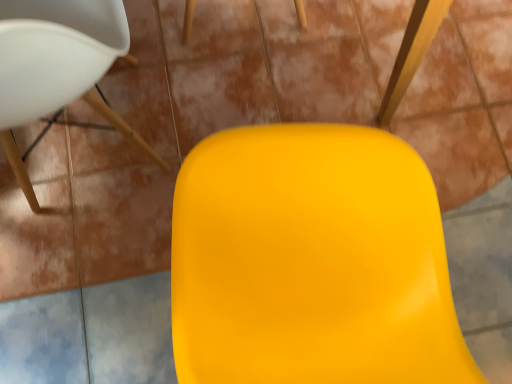
Looking at this image, what is the approximate width of glossy plastic swivel chair at center?

The width of glossy plastic swivel chair at center is 21.85 inches.

The height and width of the screenshot is (384, 512). Describe the element at coordinates (311, 261) in the screenshot. I see `glossy plastic swivel chair at center` at that location.

Image resolution: width=512 pixels, height=384 pixels. In order to click on glossy plastic swivel chair at center in this screenshot , I will do 311,261.

Image resolution: width=512 pixels, height=384 pixels. I want to click on matte white chair at upper left, so click(x=57, y=65).

Image resolution: width=512 pixels, height=384 pixels. What do you see at coordinates (57, 65) in the screenshot?
I see `matte white chair at upper left` at bounding box center [57, 65].

This screenshot has width=512, height=384. In order to click on glossy plastic swivel chair at center in this screenshot , I will do `click(311, 261)`.

Can you confirm if glossy plastic swivel chair at center is positioned to the left of matte white chair at upper left?

Incorrect, glossy plastic swivel chair at center is not on the left side of matte white chair at upper left.

Does glossy plastic swivel chair at center come behind matte white chair at upper left?

No, the depth of glossy plastic swivel chair at center is less than that of matte white chair at upper left.

Is point (252, 130) farther from viewer compared to point (127, 46)?

No, it is not.

From the image's perspective, is glossy plastic swivel chair at center under matte white chair at upper left?

Yes, from the image's perspective, glossy plastic swivel chair at center is below matte white chair at upper left.

From a real-world perspective, is glossy plastic swivel chair at center beneath matte white chair at upper left?

No.

Is glossy plastic swivel chair at center thinner than matte white chair at upper left?

Yes, glossy plastic swivel chair at center is thinner than matte white chair at upper left.

Is glossy plastic swivel chair at center taller or shorter than matte white chair at upper left?

glossy plastic swivel chair at center is shorter than matte white chair at upper left.

Considering the sizes of glossy plastic swivel chair at center and matte white chair at upper left in the image, is glossy plastic swivel chair at center bigger or smaller than matte white chair at upper left?

Considering their sizes, glossy plastic swivel chair at center takes up less space than matte white chair at upper left.

Is matte white chair at upper left a part of glossy plastic swivel chair at center?

No, matte white chair at upper left is located outside of glossy plastic swivel chair at center.

Is glossy plastic swivel chair at center next to matte white chair at upper left and touching it?

No.

Is glossy plastic swivel chair at center facing away from matte white chair at upper left?

No, glossy plastic swivel chair at center is not facing the opposite direction of matte white chair at upper left.

How much distance is there between glossy plastic swivel chair at center and matte white chair at upper left?

glossy plastic swivel chair at center and matte white chair at upper left are 17.81 inches apart from each other.

Identify the location of swivel chair on the right of matte white chair at upper left. (311, 261).

Can you confirm if matte white chair at upper left is positioned to the left of glossy plastic swivel chair at center?

Yes, matte white chair at upper left is to the left of glossy plastic swivel chair at center.

Considering the positions of objects matte white chair at upper left and glossy plastic swivel chair at center in the image provided, who is in front, matte white chair at upper left or glossy plastic swivel chair at center?

glossy plastic swivel chair at center is closer to the camera.

Considering the positions of points (142, 146) and (307, 251), is point (142, 146) farther from camera compared to point (307, 251)?

Yes, point (142, 146) is behind point (307, 251).

From the image's perspective, does matte white chair at upper left appear higher than glossy plastic swivel chair at center?

Yes, from the image's perspective, matte white chair at upper left is on top of glossy plastic swivel chair at center.

From a real-world perspective, which is physically below, matte white chair at upper left or glossy plastic swivel chair at center?

matte white chair at upper left is physically lower.

Which of these two, matte white chair at upper left or glossy plastic swivel chair at center, is wider?

Wider between the two is matte white chair at upper left.

Which of these two, matte white chair at upper left or glossy plastic swivel chair at center, stands taller?

Standing taller between the two is matte white chair at upper left.

Who is bigger, matte white chair at upper left or glossy plastic swivel chair at center?

matte white chair at upper left is bigger.

Which is correct: matte white chair at upper left is inside glossy plastic swivel chair at center, or outside of it?

matte white chair at upper left is not inside glossy plastic swivel chair at center, it's outside.

Is matte white chair at upper left far away from glossy plastic swivel chair at center?

No, matte white chair at upper left is in close proximity to glossy plastic swivel chair at center.

Is matte white chair at upper left oriented towards glossy plastic swivel chair at center?

Answer: No, matte white chair at upper left is not turned towards glossy plastic swivel chair at center.

What's the angular difference between matte white chair at upper left and glossy plastic swivel chair at center's facing directions?

The angular difference between matte white chair at upper left and glossy plastic swivel chair at center is 16.3 degrees.

Identify the location of chair that appears on the left of glossy plastic swivel chair at center. Image resolution: width=512 pixels, height=384 pixels. (57, 65).

Identify the location of chair below the glossy plastic swivel chair at center (from a real-world perspective). (x=57, y=65).

Find the location of a particular element. swivel chair in front of the matte white chair at upper left is located at coordinates (311, 261).